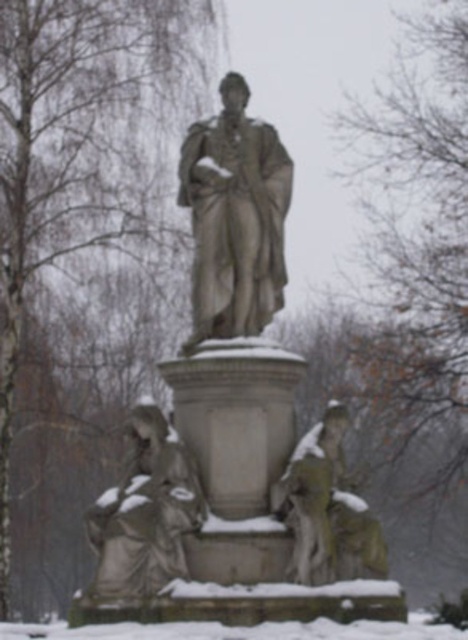
Question: Which object appears closest to the camera in this image?

Choices:
 (A) gray stone statue at center
 (B) gray stone figure at lower left

Answer: (B)

Question: Observing the image, what is the correct spatial positioning of bare branches at center in reference to gray stone figure at lower left?

Choices:
 (A) below
 (B) above

Answer: (B)

Question: Which of the following is the farthest from the observer?

Choices:
 (A) 85,433
 (B) 216,131
 (C) 172,557

Answer: (A)

Question: Can you confirm if bare branches at center is wider than bare branches at upper center?

Choices:
 (A) no
 (B) yes

Answer: (B)

Question: Observing the image, what is the correct spatial positioning of gray stone figure at lower left in reference to green mossy statue at lower right?

Choices:
 (A) left
 (B) right

Answer: (A)

Question: Which point appears closest to the camera in this image?

Choices:
 (A) (358, 627)
 (B) (108, 577)

Answer: (A)